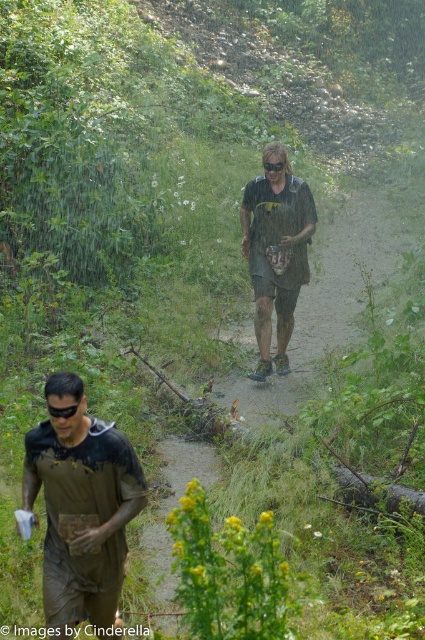
Is brown mud-covered shirt at lower left shorter than green fabric shirt at center?

Yes.

Looking at this image, is brown mud-covered shirt at lower left to the right of green fabric shirt at center from the viewer's perspective?

In fact, brown mud-covered shirt at lower left is to the left of green fabric shirt at center.

Between point (79, 438) and point (249, 275), which one is positioned behind?

Point (249, 275)

The width and height of the screenshot is (425, 640). What are the coordinates of `brown mud-covered shirt at lower left` in the screenshot? It's located at (81, 506).